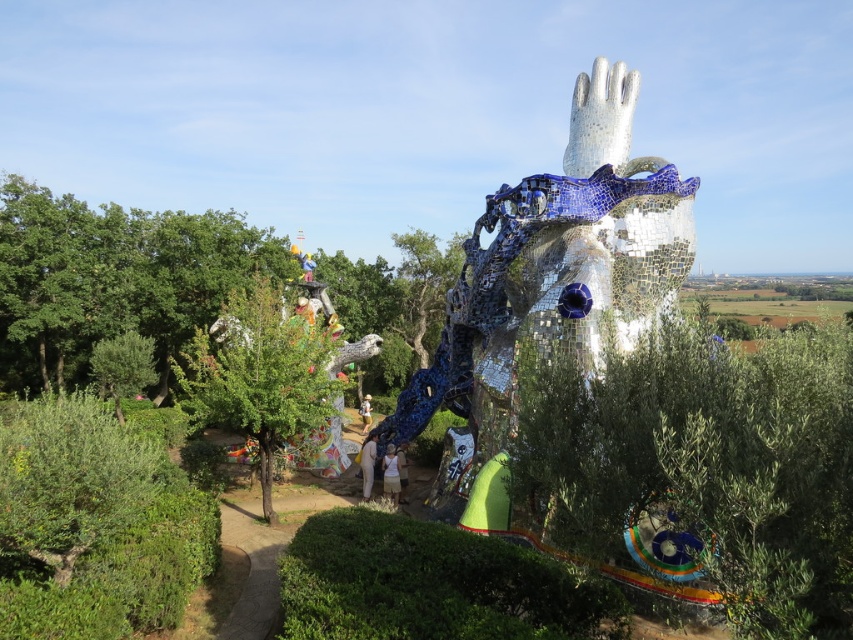
You are standing in front of the sculpture and want to place a small flower pot on the white fabric at center. Can you place it there without it being under the mosaic hand at center?

The mosaic hand at center is above the white fabric at center, so placing the flower pot on the white fabric at center would mean it is under the mosaic hand at center. Therefore, you cannot place it there without it being under the mosaic hand at center.

Consider the image. You are standing in the outdoor area and see the green leafy hedge at lower left and the white fabric at center. Which object is positioned higher in the scene?

The green leafy hedge at lower left is above the white fabric at center, so it is positioned higher in the scene.

You are an artist planning to paint the scene. You want to ensure the green leafy hedge at lower left and white fabric at center are proportionally accurate. Which object should you paint larger?

The green leafy hedge at lower left should be painted larger than the white fabric at center because it has a larger size compared to the white fabric at center.